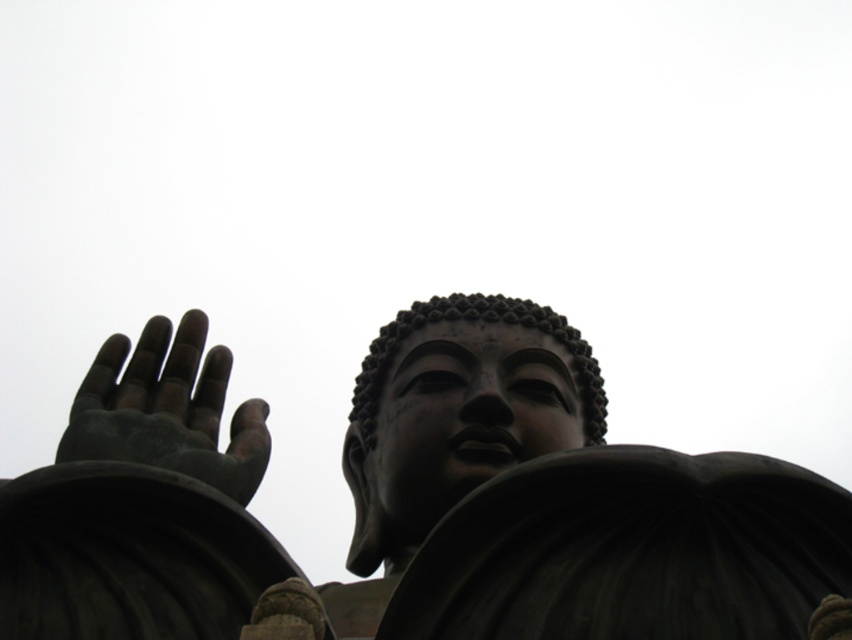
You are a photographer standing at the base of the black polished statue at center. You want to take a photo of the statue and include the distant mountain range in the background. The camera you have can capture objects up to 50 meters away. Will the mountain range be in focus if you focus on the statue?

The statue and the mountain range are 46.40 meters apart. Since the camera can capture objects up to 50 meters away, focusing on the statue will keep the mountain range within the camera range, so yes, the mountain range will be in focus.

Looking at this image, you are standing in front of the statue and want to touch both the matte black statue at center and the matte bronze hand at lower left. Which object will you need to reach out further to touch?

You will need to reach further to touch the matte bronze hand at lower left because it is closer to you than the matte black statue at center, which is further away.